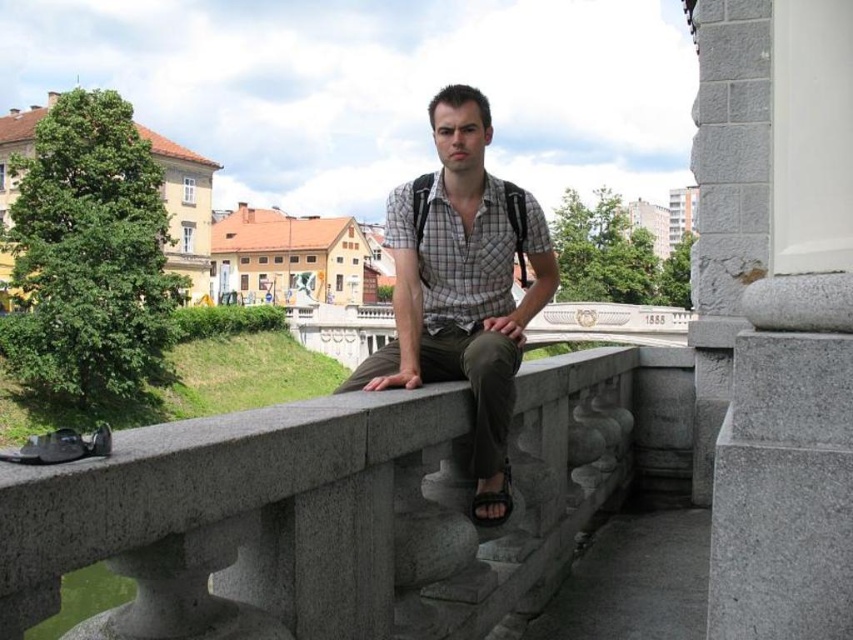
Question: Which object appears closest to the camera in this image?

Choices:
 (A) black leather sandal at lower center
 (B) gray stone rail at center
 (C) checkered fabric shirt at center

Answer: (B)

Question: In this image, where is gray stone rail at center located relative to checkered fabric shirt at center?

Choices:
 (A) above
 (B) below

Answer: (B)

Question: Among these points, which one is farthest from the camera?

Choices:
 (A) (x=491, y=493)
 (B) (x=541, y=563)

Answer: (B)

Question: Is gray stone rail at center bigger than black leather sandal at lower center?

Choices:
 (A) no
 (B) yes

Answer: (B)

Question: Is gray stone rail at center to the right of black leather sandal at lower center from the viewer's perspective?

Choices:
 (A) no
 (B) yes

Answer: (B)

Question: Estimate the real-world distances between objects in this image. Which object is farther from the black leather sandal at lower center?

Choices:
 (A) checkered fabric shirt at center
 (B) gray stone rail at center

Answer: (B)